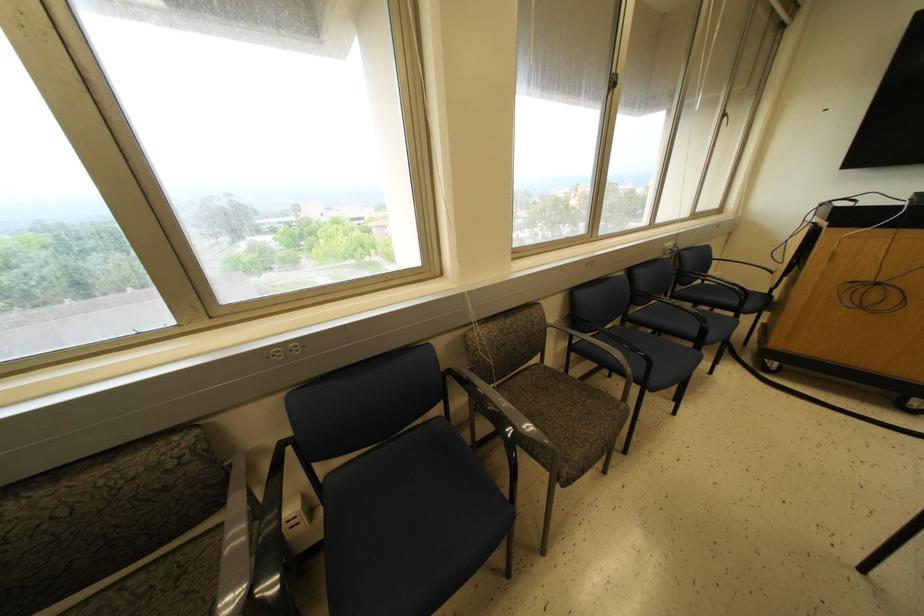
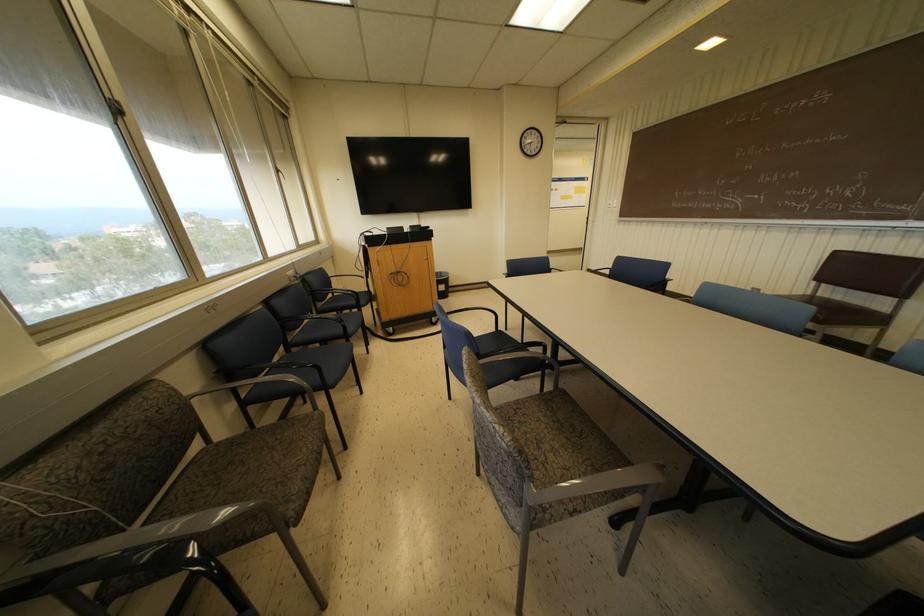
Locate, in the second image, the point that corresponds to (x=669, y=244) in the first image.

(289, 272)